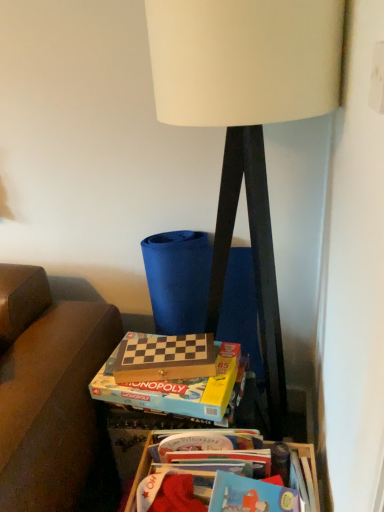
Question: Could you tell me if wooden chess set at lower center, which is the 2th paperback book from front to back, is facing white matte lamp at center?

Choices:
 (A) no
 (B) yes

Answer: (B)

Question: Is wooden chess set at lower center, which appears as the first paperback book when viewed from the back, at the right side of white matte lamp at center?

Choices:
 (A) no
 (B) yes

Answer: (A)

Question: Is wooden chess set at lower center, which appears as the first paperback book when viewed from the back, surrounding white matte lamp at center?

Choices:
 (A) no
 (B) yes

Answer: (A)

Question: Is wooden chess set at lower center, which appears as the first paperback book when viewed from the back, looking in the opposite direction of white matte lamp at center?

Choices:
 (A) yes
 (B) no

Answer: (B)

Question: Is wooden chess set at lower center, which is the 2th paperback book from front to back, not near white matte lamp at center?

Choices:
 (A) yes
 (B) no

Answer: (B)

Question: In the image, is wooden chess set at center, the 1th paperback book in the front-to-back sequence, positioned in front of or behind wooden at lower right?

Choices:
 (A) behind
 (B) front

Answer: (A)

Question: Is wooden chess set at center, which ranks as the 2th paperback book in back-to-front order, bigger or smaller than wooden at lower right?

Choices:
 (A) small
 (B) big

Answer: (A)

Question: From the image's perspective, relative to wooden at lower right, is wooden chess set at center, the 1th paperback book in the front-to-back sequence, above or below?

Choices:
 (A) above
 (B) below

Answer: (A)

Question: From a real-world perspective, is wooden chess set at center, which ranks as the 2th paperback book in back-to-front order, above or below wooden at lower right?

Choices:
 (A) below
 (B) above

Answer: (B)

Question: Visually, is wooden at lower right positioned to the left or to the right of wooden chess set at center, the 1th paperback book in the front-to-back sequence?

Choices:
 (A) left
 (B) right

Answer: (B)

Question: From the image's perspective, is wooden at lower right above or below wooden chess set at center, the 1th paperback book in the front-to-back sequence?

Choices:
 (A) below
 (B) above

Answer: (A)

Question: In terms of width, does wooden at lower right look wider or thinner when compared to wooden chess set at center, the 1th paperback book in the front-to-back sequence?

Choices:
 (A) wide
 (B) thin

Answer: (B)

Question: Is wooden at lower right situated inside wooden chess set at center, which ranks as the 2th paperback book in back-to-front order, or outside?

Choices:
 (A) inside
 (B) outside

Answer: (B)

Question: Is point (193, 387) positioned closer to the camera than point (147, 375)?

Choices:
 (A) farther
 (B) closer

Answer: (B)

Question: In terms of width, does wooden chess set at center, which ranks as the 2th paperback book in back-to-front order, look wider or thinner when compared to wooden chess set at lower center, which appears as the first paperback book when viewed from the back?

Choices:
 (A) thin
 (B) wide

Answer: (B)